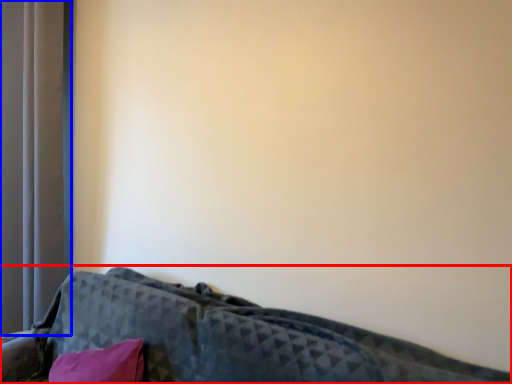
Question: Which object is closer to the camera taking this photo, furniture (highlighted by a red box) or curtain (highlighted by a blue box)?

Choices:
 (A) furniture
 (B) curtain

Answer: (A)